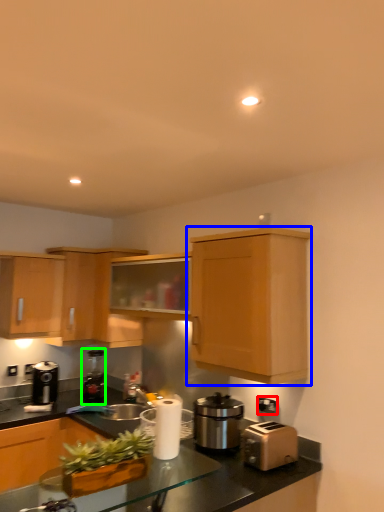
Question: Based on their relative distances, which object is nearer to electric outlet (highlighted by a red box)? Choose from cabinetry (highlighted by a blue box) and coffee machine (highlighted by a green box).

Choices:
 (A) cabinetry
 (B) coffee machine

Answer: (A)